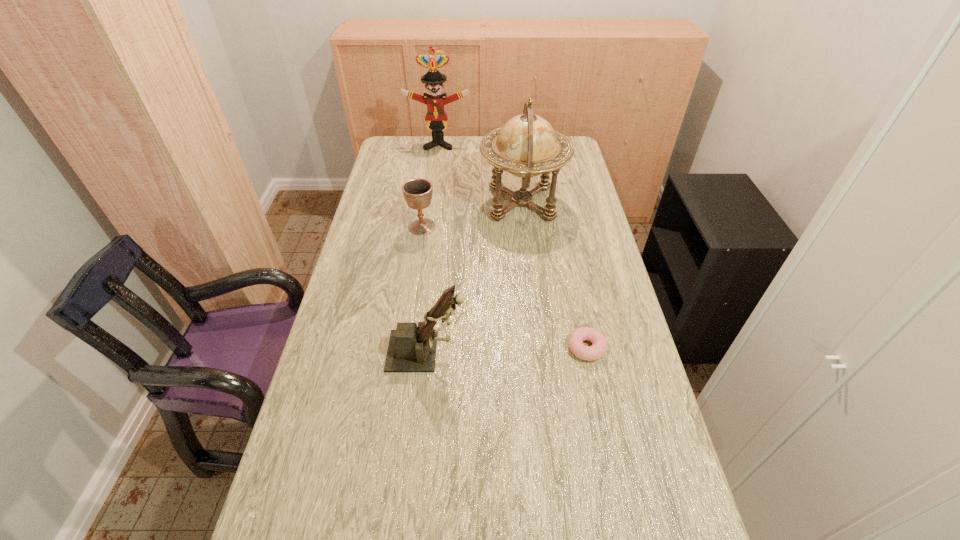
The image size is (960, 540). Identify the location of free space located on the right of the fourth tallest object. (473, 227).

Where is `free space located on the left of the shortest object`? Image resolution: width=960 pixels, height=540 pixels. free space located on the left of the shortest object is located at coordinates (459, 348).

At what (x,y) coordinates should I click in order to perform the action: click on object located in the far edge section of the desktop. Please return your answer as a coordinate pair (x, y). Looking at the image, I should click on point(436,116).

You are a GUI agent. You are given a task and a screenshot of the screen. Output one action in this format:
    pyautogui.click(x=<x>, y=<y>)
    Task: Click on the object at the left edge
    The image size is (960, 540).
    Given the screenshot: What is the action you would take?
    pyautogui.click(x=436, y=116)

Identify the location of globe at the right edge. (526, 146).

The height and width of the screenshot is (540, 960). Identify the location of doughnut at the right edge. (575, 340).

Find the location of `object situated at the far left corner`. object situated at the far left corner is located at coordinates click(436, 116).

This screenshot has height=540, width=960. In order to click on free region at the far edge of the desktop in this screenshot , I will do `click(469, 136)`.

The width and height of the screenshot is (960, 540). In the image, there is a desktop. Identify the location of vacant space at the left edge. [290, 457].

Where is `vacant region at the right edge of the desktop`? This screenshot has width=960, height=540. vacant region at the right edge of the desktop is located at coordinates (635, 429).